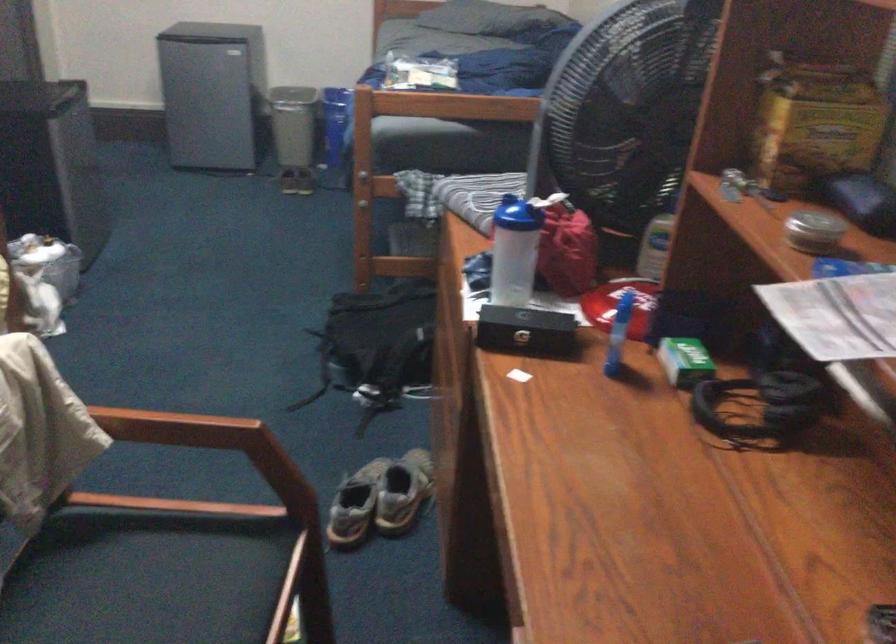
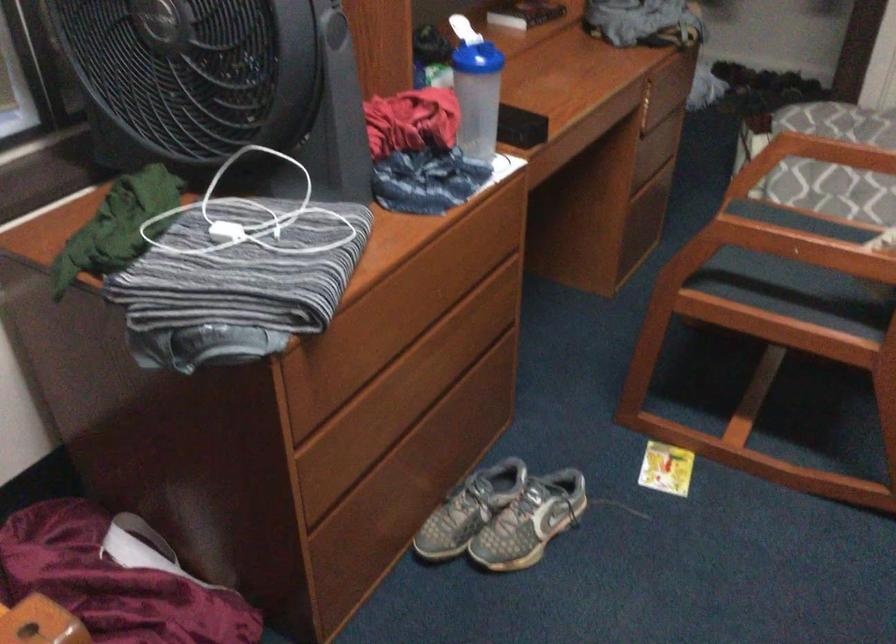
The point at (149, 413) is marked in the first image. Where is the corresponding point in the second image?

(826, 234)